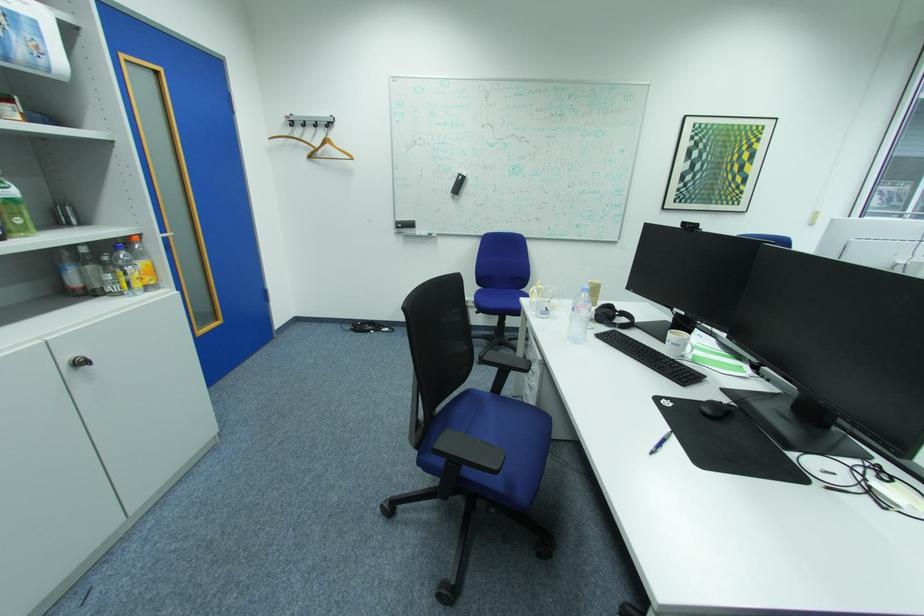
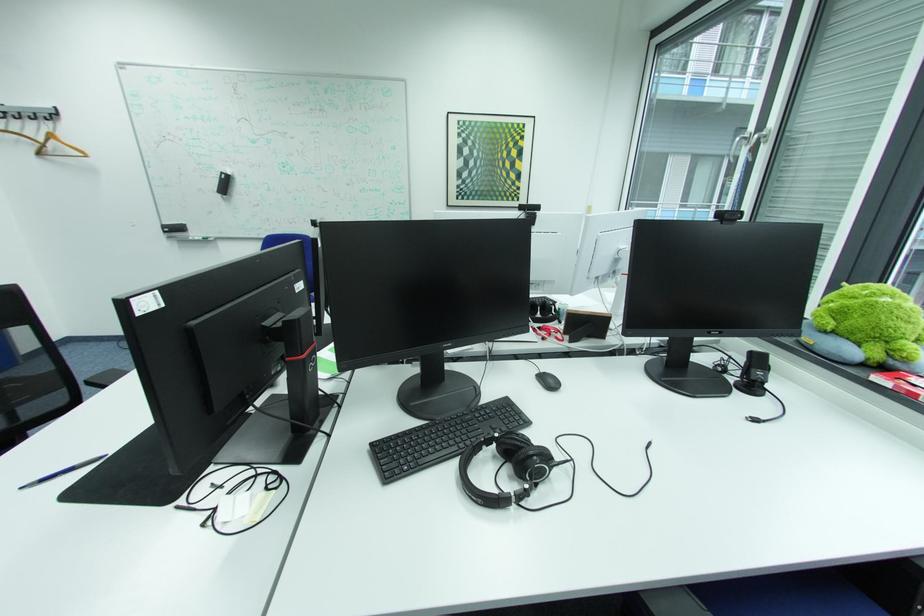
Where in the second image is the point corresponding to pixel 835 488 from the first image?

(187, 508)